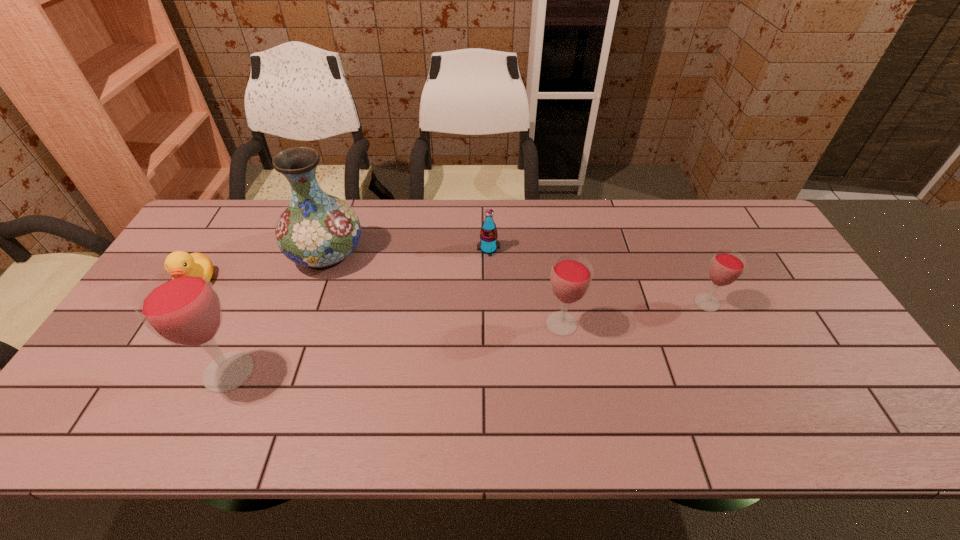
Image resolution: width=960 pixels, height=540 pixels. Find the location of `the nearest wineglass`. the nearest wineglass is located at coordinates (181, 306).

In order to click on the nearest object in this screenshot , I will do `click(181, 306)`.

Locate an element on the screen. Image resolution: width=960 pixels, height=540 pixels. the third tallest object is located at coordinates (571, 275).

This screenshot has height=540, width=960. I want to click on the fifth object from left to right, so click(x=571, y=275).

The height and width of the screenshot is (540, 960). What are the coordinates of `the rightmost wineglass` in the screenshot? It's located at (726, 266).

Identify the location of the rightmost object. (726, 266).

Identify the location of duck. tap(176, 259).

This screenshot has height=540, width=960. Identify the location of the leftmost object. (176, 259).

This screenshot has width=960, height=540. I want to click on vase, so click(317, 230).

Where is `soda`? This screenshot has width=960, height=540. soda is located at coordinates (488, 244).